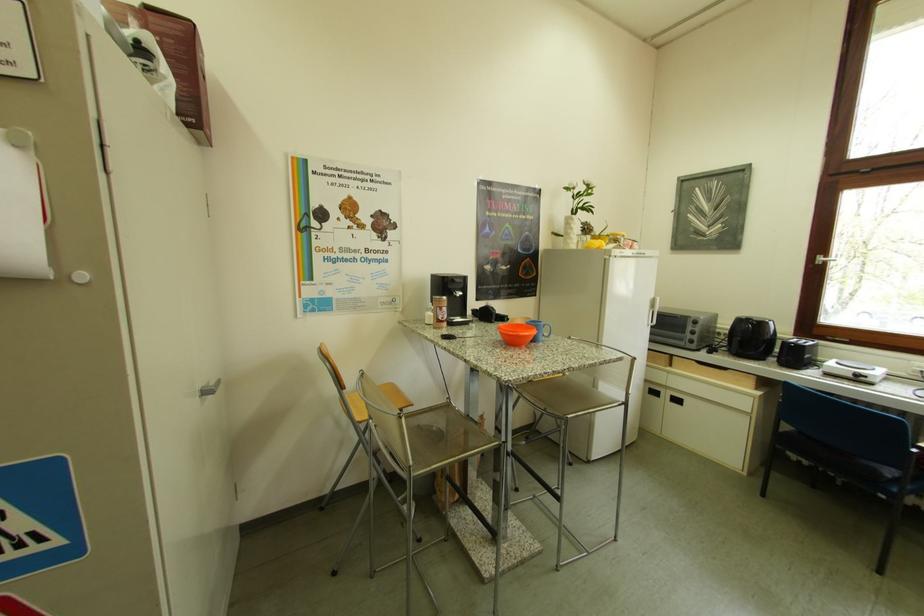
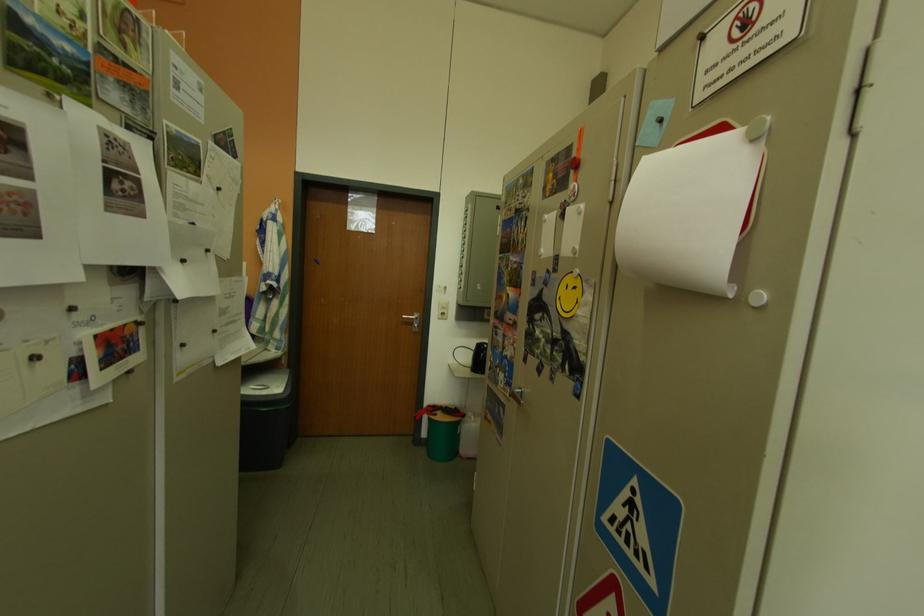
Question: Based on the continuous images, in which direction is the camera rotating? Reply with the corresponding letter.

Choices:
 (A) Left
 (B) Right
 (C) Up
 (D) Down

Answer: (A)